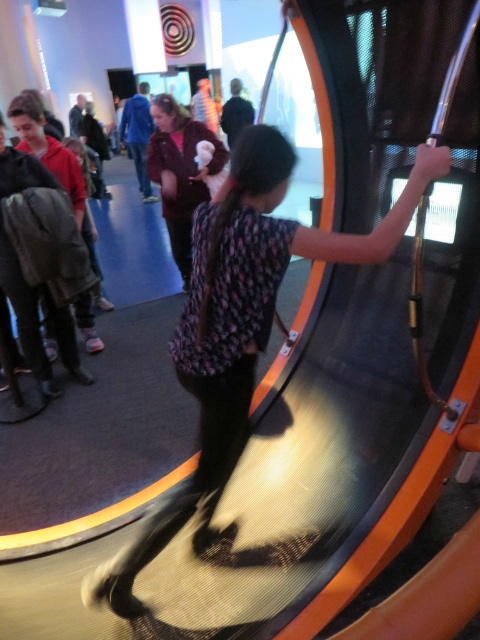
Question: Observing the image, what is the correct spatial positioning of patterned fabric dress at center in reference to velvet brown coat at center?

Choices:
 (A) right
 (B) left

Answer: (A)

Question: Does patterned fabric dress at center lie in front of velvet brown coat at center?

Choices:
 (A) no
 (B) yes

Answer: (B)

Question: Does patterned fabric dress at center lie in front of velvet brown coat at center?

Choices:
 (A) yes
 (B) no

Answer: (A)

Question: Which point appears closest to the camera in this image?

Choices:
 (A) (405, 211)
 (B) (186, 272)

Answer: (A)

Question: Which point appears farthest from the camera in this image?

Choices:
 (A) (290, 244)
 (B) (157, 164)

Answer: (B)